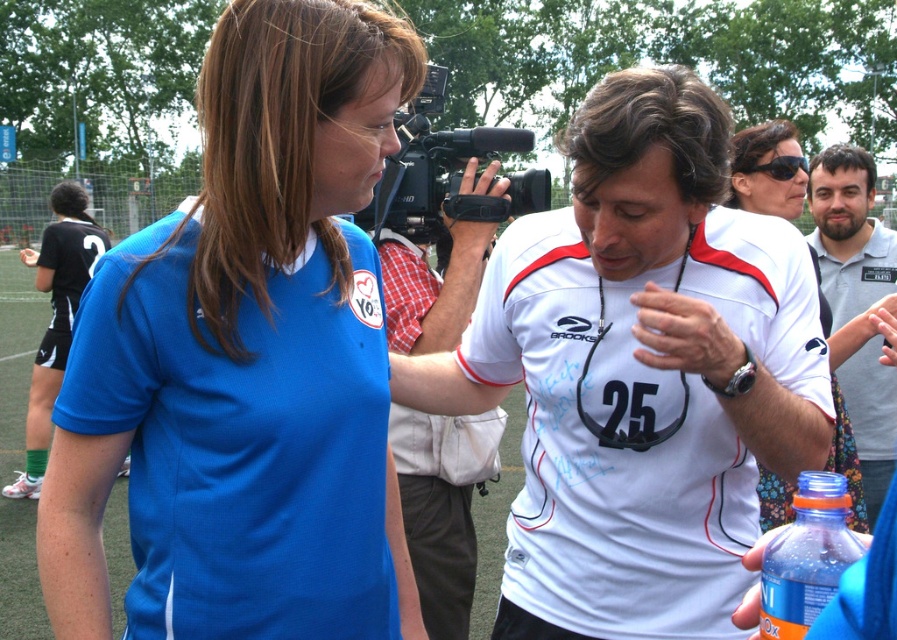
Looking at this image, is white matte jersey at center wider than gray cotton polo shirt at center?

No, white matte jersey at center is not wider than gray cotton polo shirt at center.

Between white matte jersey at center and gray cotton polo shirt at center, which one has more height?

white matte jersey at center

You are a GUI agent. You are given a task and a screenshot of the screen. Output one action in this format:
    pyautogui.click(x=<x>, y=<y>)
    Task: Click on the white matte jersey at center
    
    Given the screenshot: What is the action you would take?
    (x=434, y=528)

Identify the location of white matte jersey at center. (434, 528).

Does gray cotton polo shirt at center have a greater height compared to translucent plastic bottle at lower right?

Correct, gray cotton polo shirt at center is much taller as translucent plastic bottle at lower right.

Is gray cotton polo shirt at center positioned behind translucent plastic bottle at lower right?

Yes, gray cotton polo shirt at center is further from the viewer.

What do you see at coordinates (848, 232) in the screenshot?
I see `gray cotton polo shirt at center` at bounding box center [848, 232].

Locate an element on the screen. Image resolution: width=897 pixels, height=640 pixels. gray cotton polo shirt at center is located at coordinates (848, 232).

Which is in front, point (302, 236) or point (568, 260)?

Point (302, 236) is more forward.

Who is more forward, (127, 417) or (632, 163)?

Point (127, 417) is more forward.

In order to click on matte blue jersey at center in this screenshot , I will do `click(246, 358)`.